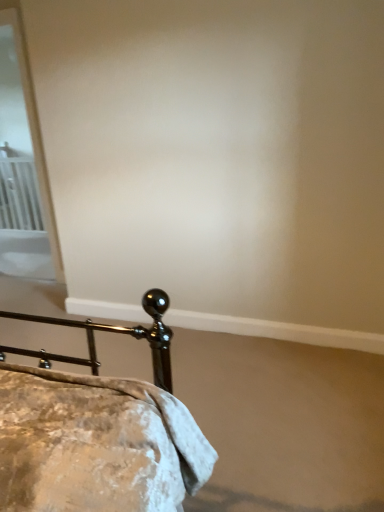
Question: From a real-world perspective, is white metal radiator at left located higher than metallic gold bed at lower left?

Choices:
 (A) yes
 (B) no

Answer: (A)

Question: Can you see white metal radiator at left touching metallic gold bed at lower left?

Choices:
 (A) yes
 (B) no

Answer: (B)

Question: Is white metal radiator at left at the right side of metallic gold bed at lower left?

Choices:
 (A) yes
 (B) no

Answer: (B)

Question: Is white metal radiator at left at the left side of metallic gold bed at lower left?

Choices:
 (A) no
 (B) yes

Answer: (B)

Question: Can you confirm if white metal radiator at left is thinner than metallic gold bed at lower left?

Choices:
 (A) no
 (B) yes

Answer: (B)

Question: Can you confirm if white metal radiator at left is wider than metallic gold bed at lower left?

Choices:
 (A) yes
 (B) no

Answer: (B)

Question: Is white glossy screen door at upper left aimed at white metal radiator at left?

Choices:
 (A) no
 (B) yes

Answer: (A)

Question: Is white glossy screen door at upper left positioned behind white metal radiator at left?

Choices:
 (A) yes
 (B) no

Answer: (B)

Question: From a real-world perspective, is white glossy screen door at upper left beneath white metal radiator at left?

Choices:
 (A) no
 (B) yes

Answer: (A)

Question: Is white glossy screen door at upper left smaller than white metal radiator at left?

Choices:
 (A) yes
 (B) no

Answer: (B)

Question: Is white glossy screen door at upper left positioned in front of white metal radiator at left?

Choices:
 (A) yes
 (B) no

Answer: (A)

Question: Can you confirm if white glossy screen door at upper left is positioned to the right of white metal radiator at left?

Choices:
 (A) yes
 (B) no

Answer: (A)

Question: From the image's perspective, is white metal radiator at left located beneath white glossy screen door at upper left?

Choices:
 (A) yes
 (B) no

Answer: (A)